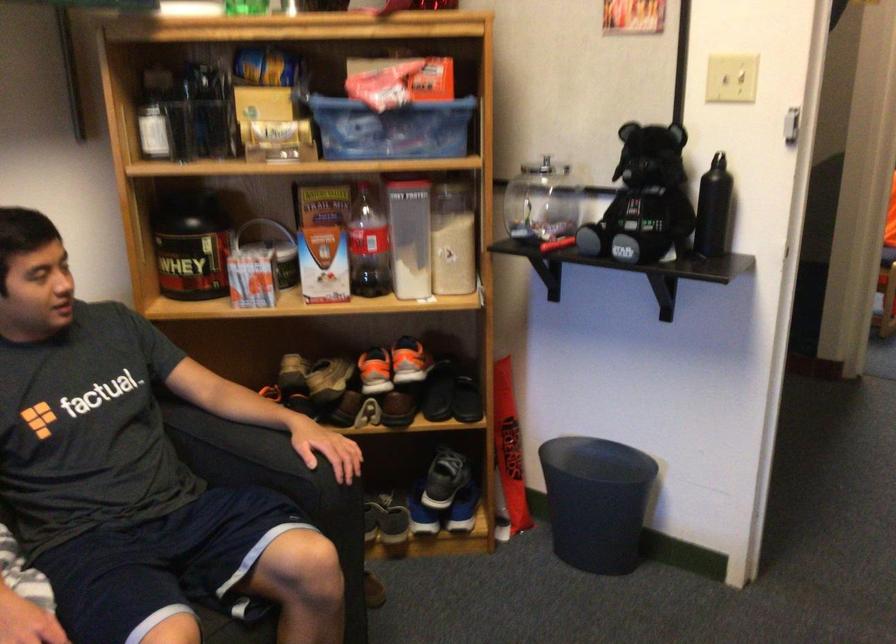
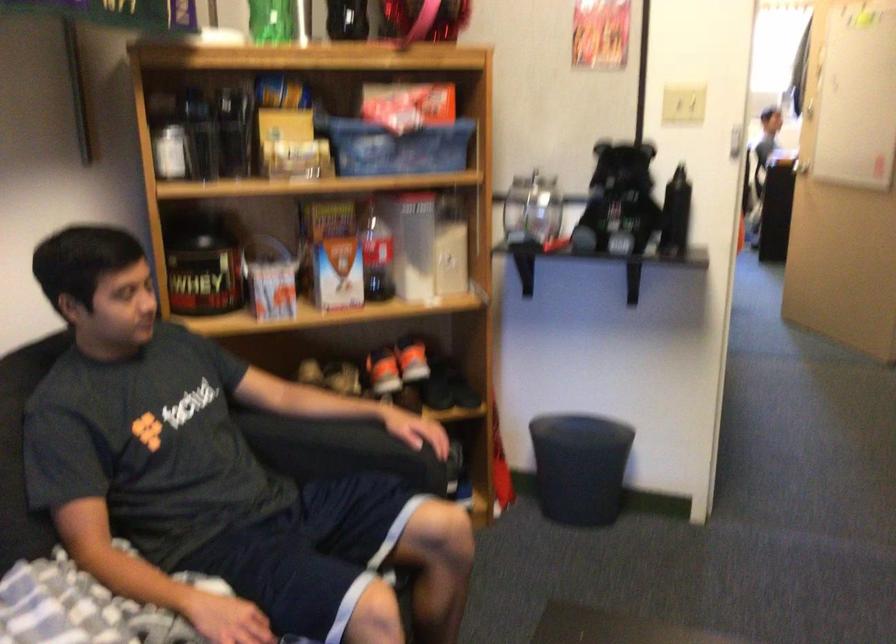
Question: Which direction would the cameraman need to move to produce the second image? Reply with the corresponding letter.

Choices:
 (A) Left
 (B) Right
 (C) Forward
 (D) Backward

Answer: (A)